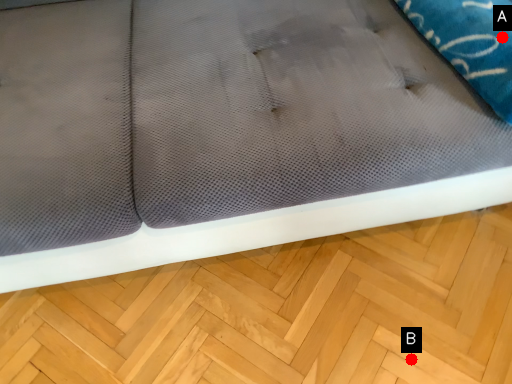
Question: Two points are circled on the image, labeled by A and B beside each circle. Which point is closer to the camera?

Choices:
 (A) A is closer
 (B) B is closer

Answer: (A)